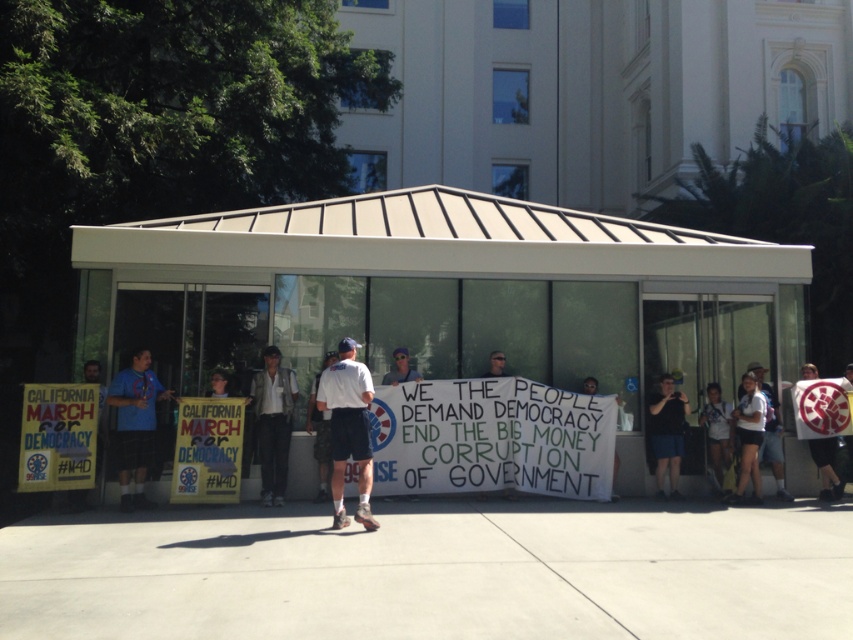
Question: Which of the following is the closest to the observer?

Choices:
 (A) matte white sign at center
 (B) gray concrete pavement at center
 (C) light gray shirt at center

Answer: (B)

Question: Which object is the farthest from the white metal bus stop at center?

Choices:
 (A) blue t-shirt at left
 (B) black fabric shorts at lower right
 (C) gray concrete pavement at center

Answer: (C)

Question: Is white metal bus stop at center behind light gray shirt at center?

Choices:
 (A) no
 (B) yes

Answer: (B)

Question: Which object is closer to the camera taking this photo?

Choices:
 (A) white paper sign at center
 (B) matte white sign at center
 (C) white metal bus stop at center

Answer: (C)

Question: Does white fabric shirt at lower right have a larger size compared to matte white sign at center?

Choices:
 (A) no
 (B) yes

Answer: (B)

Question: Is black fabric shorts at lower right thinner than white cotton shirt at center?

Choices:
 (A) no
 (B) yes

Answer: (B)